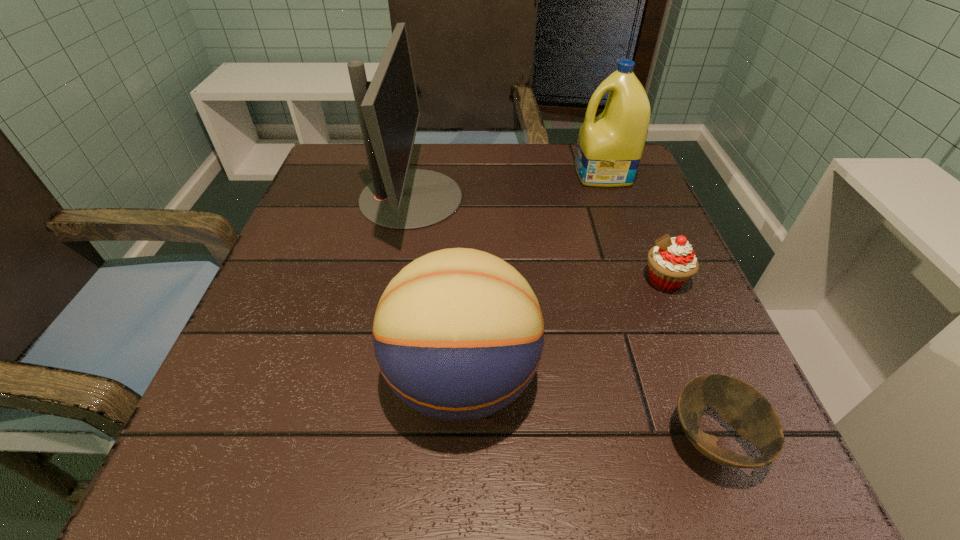
Image resolution: width=960 pixels, height=540 pixels. I want to click on vacant space in between the cupcake and the bowl, so click(688, 360).

What are the coordinates of `unoccupied position between the third nearest object and the basketball` in the screenshot? It's located at (564, 330).

Find the location of a particular element. This screenshot has height=540, width=960. empty space that is in between the bowl and the computer monitor is located at coordinates (562, 319).

This screenshot has width=960, height=540. I want to click on vacant region between the detergent and the basketball, so click(532, 276).

Where is `free space between the detergent and the tallest object`? The width and height of the screenshot is (960, 540). free space between the detergent and the tallest object is located at coordinates (507, 186).

Locate an element on the screen. The width and height of the screenshot is (960, 540). free space between the basketball and the detergent is located at coordinates (532, 276).

Where is `free spot between the detergent and the tallest object`? This screenshot has width=960, height=540. free spot between the detergent and the tallest object is located at coordinates (507, 186).

The height and width of the screenshot is (540, 960). Find the location of `vacant point located between the computer monitor and the second shortest object`. vacant point located between the computer monitor and the second shortest object is located at coordinates (538, 239).

Select which object appears as the fourth closest to the third nearest object. Please provide its 2D coordinates. Your answer should be formatted as a tuple, i.e. [(x, y)], where the tuple contains the x and y coordinates of a point satisfying the conditions above.

[(399, 198)]

Identify the location of object that is the third closest one to the third farthest object. This screenshot has height=540, width=960. (609, 148).